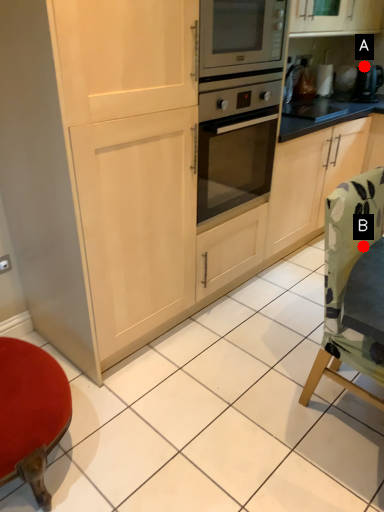
Question: Two points are circled on the image, labeled by A and B beside each circle. Which point appears farthest from the camera in this image?

Choices:
 (A) A is further
 (B) B is further

Answer: (A)